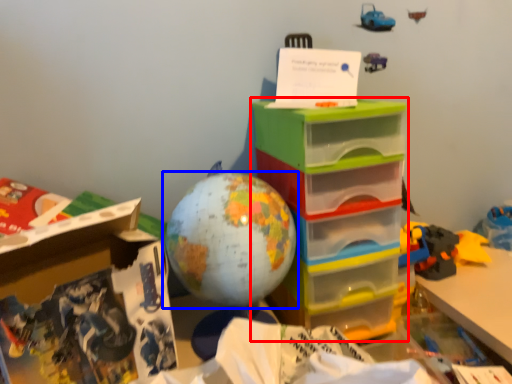
Question: Which of the following is the closest to the observer, storage box (highlighted by a red box) or toy (highlighted by a blue box)?

Choices:
 (A) storage box
 (B) toy

Answer: (B)